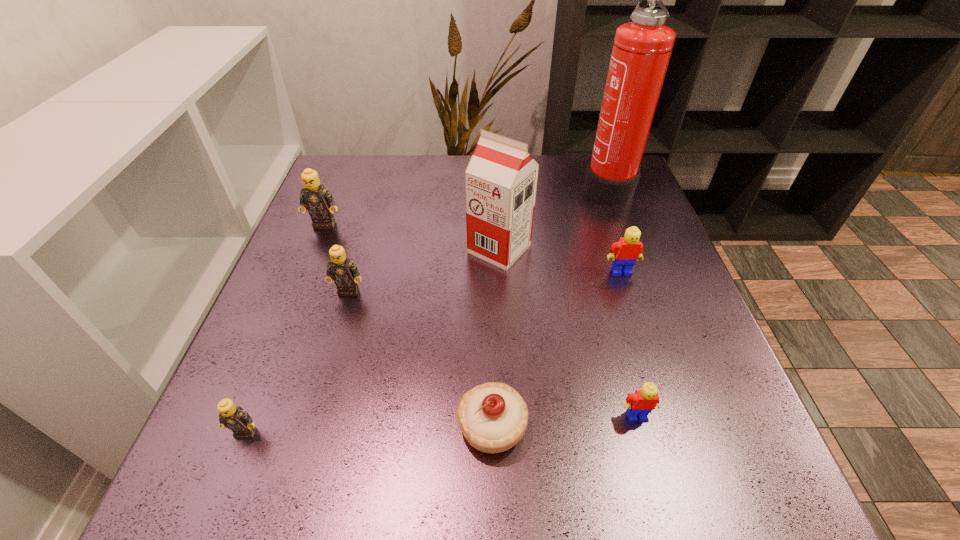
Where is `free point between the bigger yellow Lego and the soya milk`? free point between the bigger yellow Lego and the soya milk is located at coordinates (561, 260).

Locate an element on the screen. The height and width of the screenshot is (540, 960). free point between the fifth farthest object and the fourth nearest Lego is located at coordinates click(x=485, y=281).

Locate which object is the second closest to the seventh shortest object. Please provide its 2D coordinates. Your answer should be formatted as a tuple, i.e. [(x, y)], where the tuple contains the x and y coordinates of a point satisfying the conditions above.

[(641, 51)]

The height and width of the screenshot is (540, 960). In order to click on the fourth closest object to the sixth object from right to left in this screenshot , I will do `click(493, 417)`.

Select which Lego is the second closest to the fire extinguisher. Please provide its 2D coordinates. Your answer should be formatted as a tuple, i.e. [(x, y)], where the tuple contains the x and y coordinates of a point satisfying the conditions above.

[(642, 402)]

This screenshot has height=540, width=960. What are the coordinates of `Lego that is the fourth closest to the second nearest Lego` in the screenshot? It's located at (318, 200).

Point out which tan Lego is positioned as the nearest to the biggest tan Lego. Please provide its 2D coordinates. Your answer should be formatted as a tuple, i.e. [(x, y)], where the tuple contains the x and y coordinates of a point satisfying the conditions above.

[(341, 269)]

Locate an element on the screen. The width and height of the screenshot is (960, 540). the second closest tan Lego relative to the biggest tan Lego is located at coordinates (233, 417).

You are a GUI agent. You are given a task and a screenshot of the screen. Output one action in this format:
    pyautogui.click(x=<x>, y=<y>)
    Task: Click on the free space in the image that satisfies the following two spatial constraints: 1. in front of the biggest tan Lego; 2. on the left side of the beige pastry
    
    Given the screenshot: What is the action you would take?
    pyautogui.click(x=244, y=426)

Where is `vacant space that satisfies the following two spatial constraints: 1. on the back side of the seventh shortest object; 2. on the right side of the beige pastry`? This screenshot has width=960, height=540. vacant space that satisfies the following two spatial constraints: 1. on the back side of the seventh shortest object; 2. on the right side of the beige pastry is located at coordinates (489, 249).